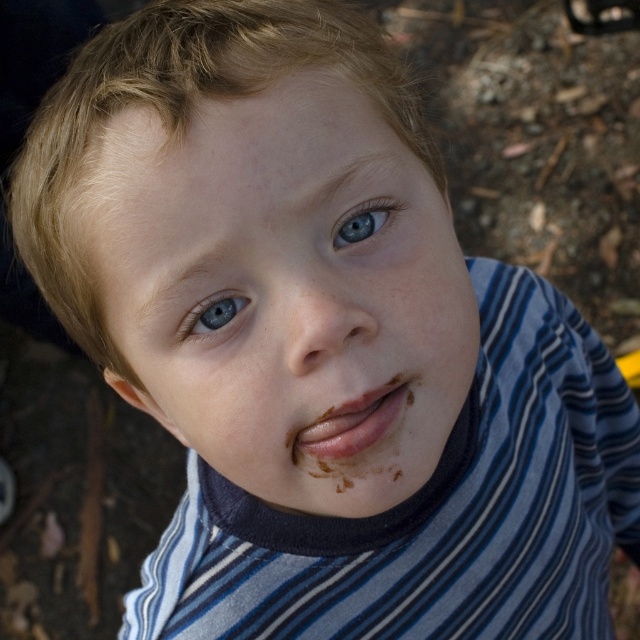
Is point (266, 205) less distant than point (362, 228)?

Yes.

Between smooth skin face at center and blue matte eye at upper center, which one has less height?

blue matte eye at upper center

Describe the element at coordinates (284, 291) in the screenshot. I see `smooth skin face at center` at that location.

Locate an element on the screen. smooth skin face at center is located at coordinates (284, 291).

Can you confirm if matte chocolate lips at center is taller than blue matte eye at upper center?

Yes.

Looking at this image, can you confirm if matte chocolate lips at center is smaller than blue matte eye at upper center?

No.

The height and width of the screenshot is (640, 640). I want to click on matte chocolate lips at center, so click(x=349, y=426).

Can you confirm if smooth skin face at center is taller than blue glossy eye at center?

Yes, smooth skin face at center is taller than blue glossy eye at center.

From the picture: Who is more distant from viewer, (164, 292) or (205, 324)?

The point (205, 324) is behind.

Locate an element on the screen. The height and width of the screenshot is (640, 640). smooth skin face at center is located at coordinates (284, 291).